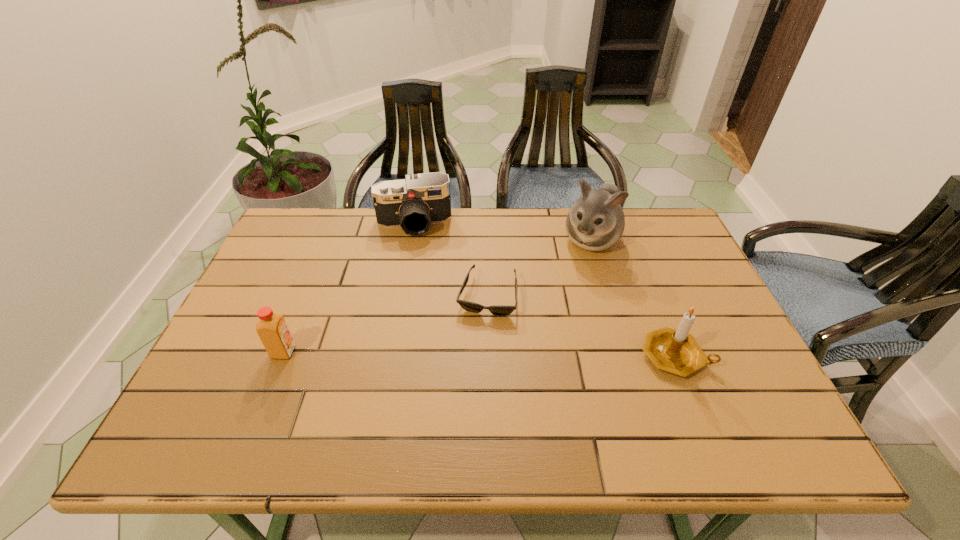
The image size is (960, 540). I want to click on vacant space located on the face of the tallest object, so click(555, 311).

In order to click on vacant space located 0.140m on the front-facing side of the third object from right to left in this screenshot , I will do `click(473, 363)`.

Where is `vacant space located on the front-facing side of the third object from right to left`? vacant space located on the front-facing side of the third object from right to left is located at coordinates (467, 397).

The image size is (960, 540). What are the coordinates of `vacant space situated 0.110m on the front-facing side of the third object from right to left` in the screenshot? It's located at (475, 354).

Locate an element on the screen. blank space located on the front-facing side of the fourth object from right to left is located at coordinates (427, 329).

The image size is (960, 540). I want to click on blank space located on the front-facing side of the fourth object from right to left, so click(427, 333).

In order to click on vacant area situated 0.170m on the front-facing side of the fourth object from right to left in this screenshot , I will do `click(421, 276)`.

The image size is (960, 540). I want to click on hamster that is at the far edge, so click(x=596, y=221).

You are a GUI agent. You are given a task and a screenshot of the screen. Output one action in this format:
    pyautogui.click(x=<x>, y=<y>)
    Task: Click on the camera that is at the far edge
    This screenshot has height=540, width=960.
    Given the screenshot: What is the action you would take?
    pyautogui.click(x=414, y=203)

I want to click on object that is positioned at the near edge, so click(675, 351).